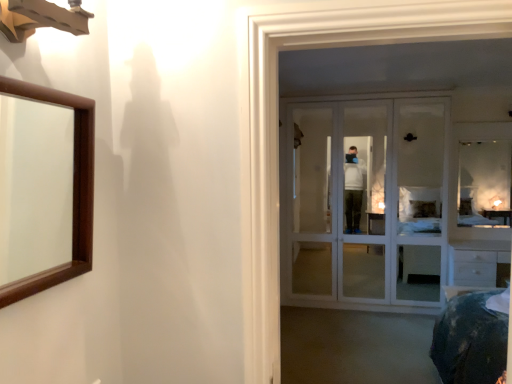
Question: From the image's perspective, is clear glass mirror at upper right, acting as the second mirror starting from the left, above or below brown wooden mirror at left, placed as the second mirror when sorted from right to left?

Choices:
 (A) below
 (B) above

Answer: (B)

Question: Is clear glass mirror at upper right, acting as the second mirror starting from the left, wider or thinner than brown wooden mirror at left, the 2th mirror from the back?

Choices:
 (A) wide
 (B) thin

Answer: (A)

Question: Considering the real-world distances, which object is farthest from the clear glass mirror at upper right, which appears as the first mirror when viewed from the back?

Choices:
 (A) white glass door at center
 (B) brown wooden mirror at left, which is counted as the first mirror, starting from the left

Answer: (B)

Question: Estimate the real-world distances between objects in this image. Which object is farther from the brown wooden mirror at left, which is the first mirror in front-to-back order?

Choices:
 (A) clear glass mirror at upper right, the 2th mirror from the front
 (B) white glass door at center

Answer: (A)